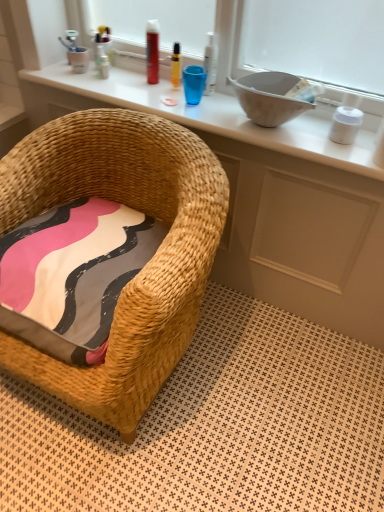
Locate an element on the screen. The width and height of the screenshot is (384, 512). vacant area that is in front of white plastic bottle at upper center, the 2th toiletry when ordered from right to left is located at coordinates (207, 111).